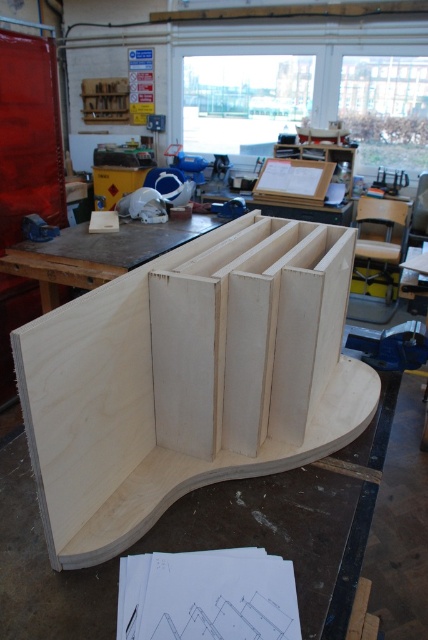
Question: In this image, where is natural wood plywood at center located relative to natural wood table at center?

Choices:
 (A) right
 (B) left

Answer: (A)

Question: Which object is the closest to the natural wood table at center?

Choices:
 (A) natural wood plywood at center
 (B) metallic blue vise at left

Answer: (B)

Question: Is natural wood table at center closer to the viewer compared to metallic blue vise at left?

Choices:
 (A) no
 (B) yes

Answer: (B)

Question: Which of the following is the farthest from the observer?

Choices:
 (A) natural wood table at center
 (B) metallic blue vise at left

Answer: (B)

Question: Can you confirm if natural wood table at center is thinner than metallic blue vise at left?

Choices:
 (A) yes
 (B) no

Answer: (B)

Question: Based on their relative distances, which object is nearer to the natural wood table at center?

Choices:
 (A) natural wood plywood at center
 (B) metallic blue vise at left

Answer: (B)